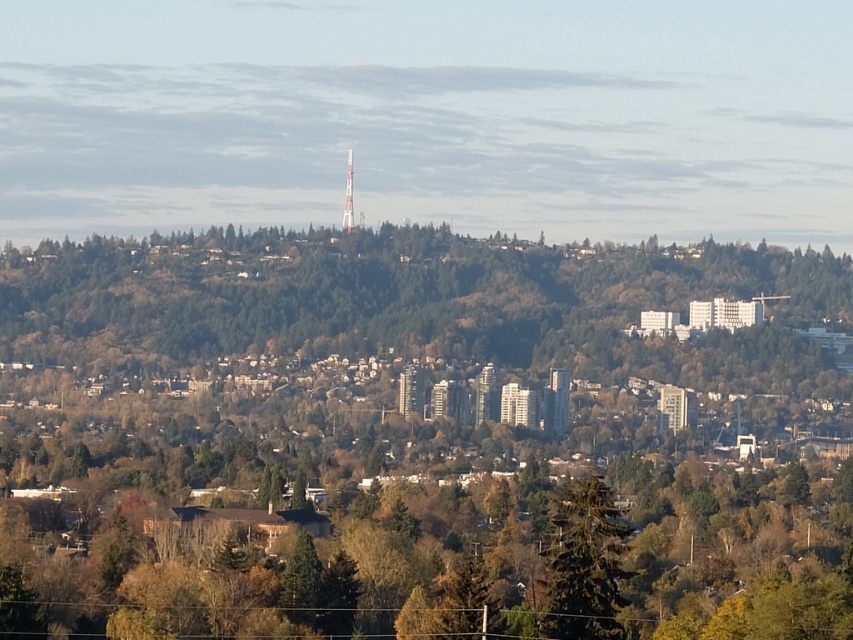
Is green matte tree at center above green textured tree at center?

Yes, green matte tree at center is above green textured tree at center.

Between point (610, 292) and point (598, 611), which one is positioned behind?

The point (598, 611) is behind.

Where is `green matte tree at center`? The width and height of the screenshot is (853, 640). green matte tree at center is located at coordinates (409, 433).

Is point (125, 532) positioned after point (346, 205)?

Yes.

Does point (393, 554) come closer to viewer compared to point (347, 160)?

Yes, it is.

Who is more forward, (86, 330) or (349, 227)?

Point (349, 227)

Locate an element on the screen. The width and height of the screenshot is (853, 640). green matte tree at center is located at coordinates (409, 433).

Is green textured tree at center thinner than silver metallic tv tower at center?

In fact, green textured tree at center might be wider than silver metallic tv tower at center.

Does green textured tree at center appear under silver metallic tv tower at center?

Correct, green textured tree at center is located below silver metallic tv tower at center.

Image resolution: width=853 pixels, height=640 pixels. What do you see at coordinates (583, 566) in the screenshot? I see `green textured tree at center` at bounding box center [583, 566].

Locate an element on the screen. This screenshot has width=853, height=640. green textured tree at center is located at coordinates (583, 566).